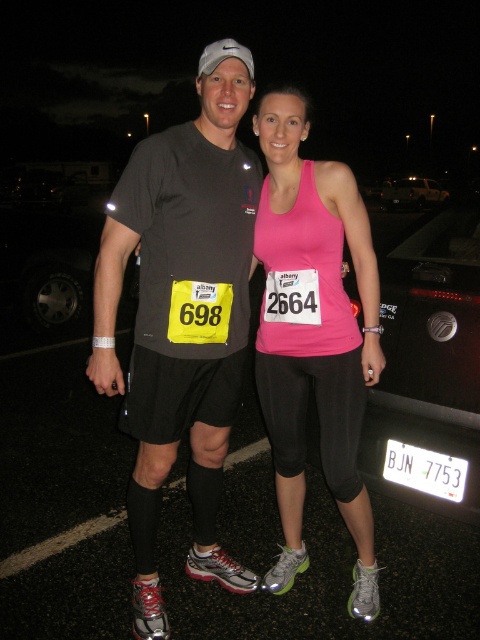
Does point (297, 369) come in front of point (408, 198)?

Yes.

Does pink matte tank top at center have a greater height compared to black matte car at center?

Correct, pink matte tank top at center is much taller as black matte car at center.

The image size is (480, 640). I want to click on pink matte tank top at center, so click(x=314, y=337).

Can you confirm if white plastic license plate at lower right is smaller than black matte car at center?

Correct, white plastic license plate at lower right occupies less space than black matte car at center.

From the picture: Measure the distance between white plastic license plate at lower right and camera.

A distance of 2.25 meters exists between white plastic license plate at lower right and camera.

This screenshot has height=640, width=480. I want to click on white plastic license plate at lower right, so click(424, 470).

Image resolution: width=480 pixels, height=640 pixels. Find the location of `white plastic license plate at lower right`. white plastic license plate at lower right is located at coordinates (424, 470).

Find the location of `matte black t-shirt at center`. matte black t-shirt at center is located at coordinates (181, 316).

What do you see at coordinates (181, 316) in the screenshot? I see `matte black t-shirt at center` at bounding box center [181, 316].

From the picture: Who is more forward, (212,218) or (424,192)?

Point (212,218) is more forward.

At what (x,y) coordinates should I click in order to perform the action: click on matte black t-shirt at center. Please return your answer as a coordinate pair (x, y). The width and height of the screenshot is (480, 640). Looking at the image, I should click on (181, 316).